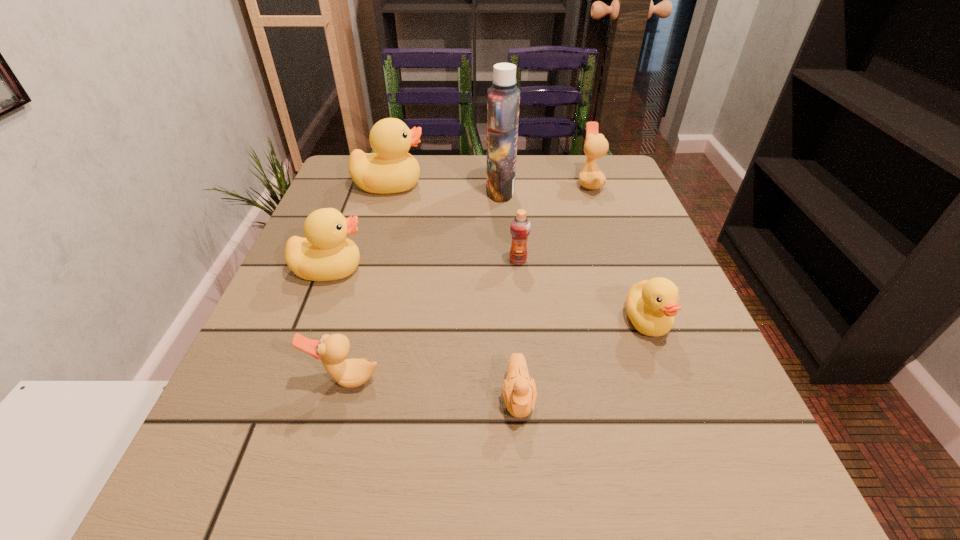
In the image, there is a desktop. At what (x,y) coordinates should I click in order to perform the action: click on vacant space at the near edge. Please return your answer as a coordinate pair (x, y). The image size is (960, 540). Looking at the image, I should click on (452, 510).

Locate an element on the screen. free region at the left edge of the desktop is located at coordinates (286, 294).

The width and height of the screenshot is (960, 540). In the image, there is a desktop. Find the location of `vacant space at the right edge`. vacant space at the right edge is located at coordinates (697, 357).

Find the location of a particular element. Image resolution: width=960 pixels, height=540 pixels. free space at the far left corner of the desktop is located at coordinates (334, 197).

Where is `free space at the near left corner`? The width and height of the screenshot is (960, 540). free space at the near left corner is located at coordinates (203, 523).

Locate an element on the screen. free spot at the far right corner of the desktop is located at coordinates (618, 157).

The image size is (960, 540). I want to click on vacant space at the near right corner of the desktop, so click(771, 526).

The image size is (960, 540). I want to click on vacant region between the nearest yellow duck and the tallest object, so click(x=574, y=255).

Locate an element on the screen. unoccupied area between the orange juice and the nearer tan duck is located at coordinates (432, 320).

The height and width of the screenshot is (540, 960). I want to click on vacant space in between the orange juice and the shortest object, so click(x=518, y=328).